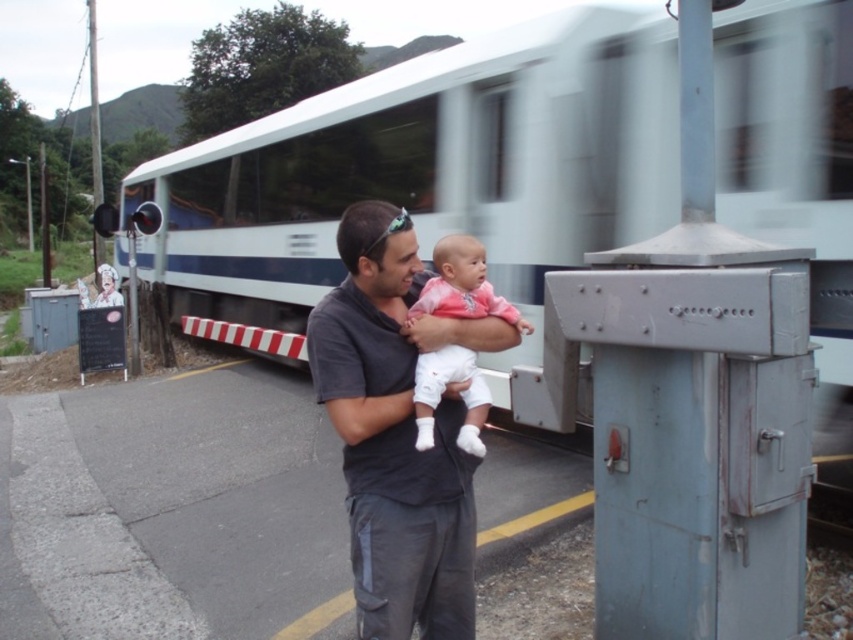
From the picture: Is white glossy train at center shorter than dark gray shirt at center?

Incorrect, white glossy train at center's height does not fall short of dark gray shirt at center's.

Image resolution: width=853 pixels, height=640 pixels. I want to click on white glossy train at center, so click(431, 172).

Who is more distant from viewer, (610, 147) or (384, 596)?

The point (610, 147) is behind.

Find the location of `white glossy train at center`. white glossy train at center is located at coordinates (431, 172).

Locate an element on the screen. dark gray shirt at center is located at coordinates (396, 433).

Which is above, white glossy train at center or pink fabric baby at center?

Positioned higher is white glossy train at center.

Is the position of white glossy train at center less distant than that of pink fabric baby at center?

Yes, white glossy train at center is closer to the viewer.

Between point (515, 228) and point (439, 243), which one is positioned behind?

Point (515, 228)

At what (x,y) coordinates should I click in order to perform the action: click on white glossy train at center. Please return your answer as a coordinate pair (x, y). Image resolution: width=853 pixels, height=640 pixels. Looking at the image, I should click on (431, 172).